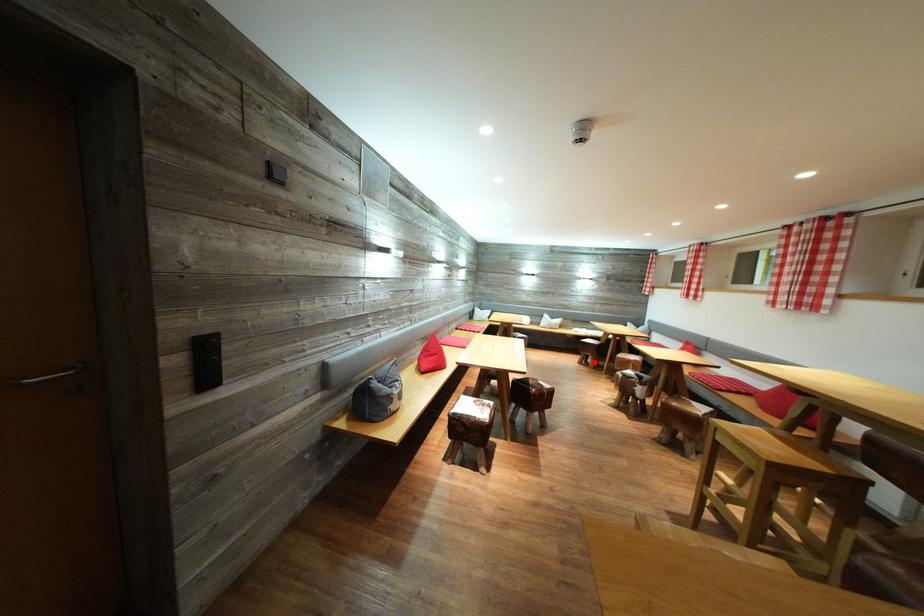
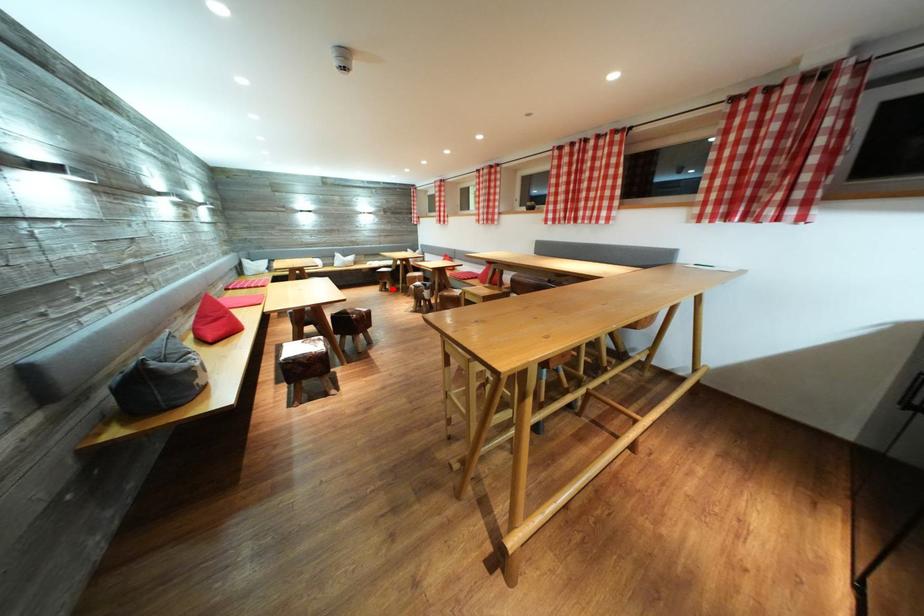
I am providing you with two images of the same scene from different viewpoints. A red point is marked on the first image and another point is marked on the second image. Does the point marked in image1 correspond to the same location as the one in image2?

Yes